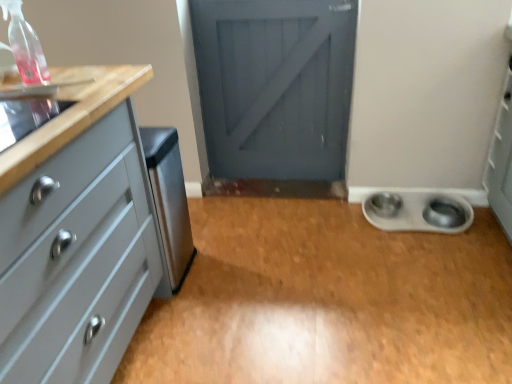
Where is `vacant area that lies in front of stainless steel trash can at left, the 2th appliance viewed from the right`? The width and height of the screenshot is (512, 384). vacant area that lies in front of stainless steel trash can at left, the 2th appliance viewed from the right is located at coordinates (177, 310).